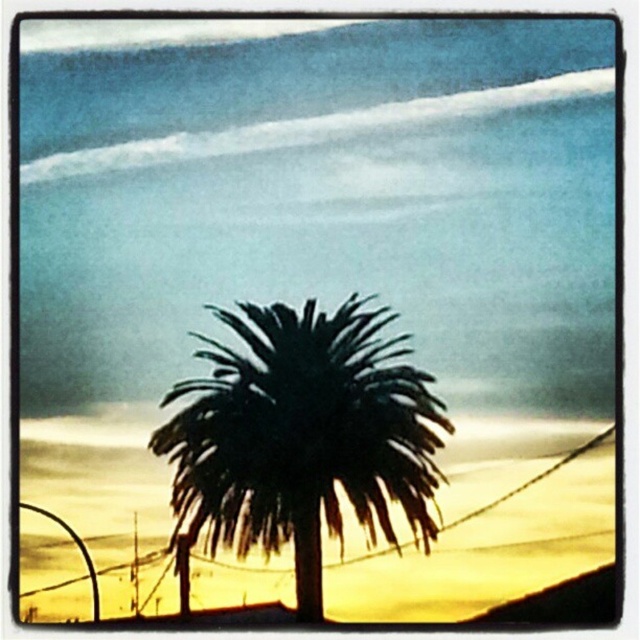
Question: Can you confirm if black wire at center is positioned above dark green leafy palm tree at center?

Choices:
 (A) no
 (B) yes

Answer: (A)

Question: Can you confirm if black wire at center is positioned to the right of dark green leafy palm tree at center?

Choices:
 (A) no
 (B) yes

Answer: (B)

Question: Is black wire at center positioned at the back of dark green leafy palm tree at center?

Choices:
 (A) yes
 (B) no

Answer: (A)

Question: Which point is closer to the camera taking this photo?

Choices:
 (A) (412, 368)
 (B) (467, 566)

Answer: (A)

Question: Which of the following is the closest to the observer?

Choices:
 (A) (496, 593)
 (B) (252, 362)

Answer: (B)